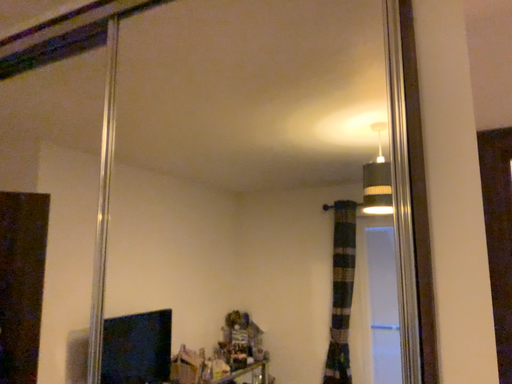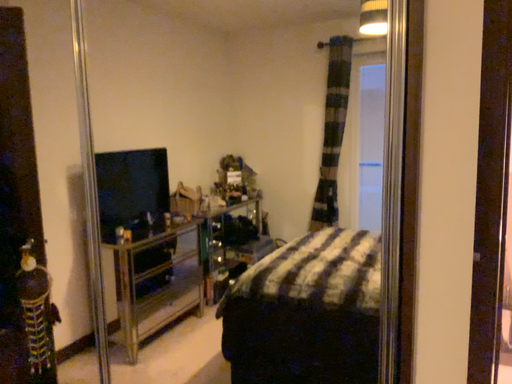
Question: Which way did the camera rotate in the video?

Choices:
 (A) rotated downward
 (B) rotated upward

Answer: (A)